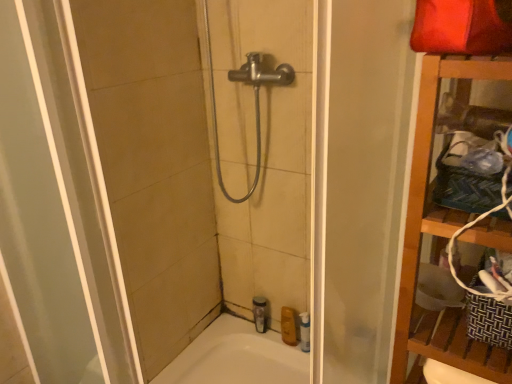
Question: From the image's perspective, is clear plastic bottle at lower center, the 1th toiletry from the left, on top of white glossy bathtub at lower center?

Choices:
 (A) no
 (B) yes

Answer: (B)

Question: Does clear plastic bottle at lower center, which is the second toiletry from right to left, come in front of white glossy bathtub at lower center?

Choices:
 (A) yes
 (B) no

Answer: (B)

Question: Is clear plastic bottle at lower center, the 1th toiletry from the left, thinner than white glossy bathtub at lower center?

Choices:
 (A) yes
 (B) no

Answer: (A)

Question: Is clear plastic bottle at lower center, the 1th toiletry from the left, not close to white glossy bathtub at lower center?

Choices:
 (A) yes
 (B) no

Answer: (B)

Question: Does clear plastic bottle at lower center, the 1th toiletry from the left, have a greater width compared to white glossy bathtub at lower center?

Choices:
 (A) no
 (B) yes

Answer: (A)

Question: From a real-world perspective, relative to yellow matte bottle at lower center, arranged as the first toiletry when viewed from the right, is transparent plastic shower door at center vertically above or below?

Choices:
 (A) below
 (B) above

Answer: (B)

Question: Based on their sizes in the image, would you say transparent plastic shower door at center is bigger or smaller than yellow matte bottle at lower center, which ranks as the 2th toiletry in left-to-right order?

Choices:
 (A) small
 (B) big

Answer: (B)

Question: Does point (193, 125) appear closer or farther from the camera than point (289, 307)?

Choices:
 (A) closer
 (B) farther

Answer: (A)

Question: Considering the positions of transparent plastic shower door at center and yellow matte bottle at lower center, arranged as the first toiletry when viewed from the right, in the image, is transparent plastic shower door at center taller or shorter than yellow matte bottle at lower center, arranged as the first toiletry when viewed from the right,?

Choices:
 (A) tall
 (B) short

Answer: (A)

Question: From the image's perspective, is transparent plastic shower door at center positioned above or below white glossy bathtub at lower center?

Choices:
 (A) above
 (B) below

Answer: (A)

Question: Is point (145, 213) positioned closer to the camera than point (203, 350)?

Choices:
 (A) farther
 (B) closer

Answer: (B)

Question: Based on their positions, is transparent plastic shower door at center located to the left or right of white glossy bathtub at lower center?

Choices:
 (A) left
 (B) right

Answer: (A)

Question: In the image, is transparent plastic shower door at center positioned in front of or behind white glossy bathtub at lower center?

Choices:
 (A) behind
 (B) front

Answer: (B)

Question: Based on their sizes in the image, would you say wooden shelf at right is bigger or smaller than yellow matte bottle at lower center, arranged as the first toiletry when viewed from the right?

Choices:
 (A) small
 (B) big

Answer: (B)

Question: From a real-world perspective, is wooden shelf at right positioned above or below yellow matte bottle at lower center, arranged as the first toiletry when viewed from the right?

Choices:
 (A) above
 (B) below

Answer: (A)